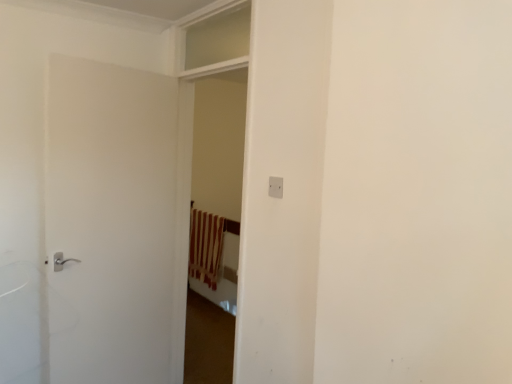
Question: From a real-world perspective, is brown striped curtain at center above or below clear glass window at upper center?

Choices:
 (A) above
 (B) below

Answer: (B)

Question: Is brown striped curtain at center in front of or behind clear glass window at upper center in the image?

Choices:
 (A) behind
 (B) front

Answer: (A)

Question: Based on their relative distances, which object is farther from the white matte door at left?

Choices:
 (A) white plastic electric outlet at center
 (B) clear glass window at upper center
 (C) brown striped curtain at center

Answer: (C)

Question: Which object is positioned farthest from the clear glass window at upper center?

Choices:
 (A) brown striped curtain at center
 (B) white plastic electric outlet at center
 (C) white matte door at left

Answer: (A)